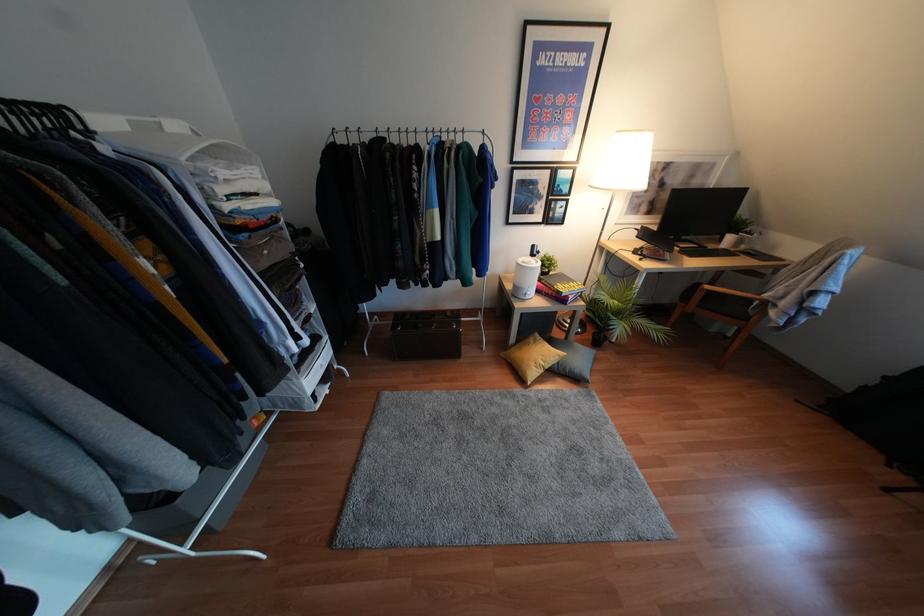
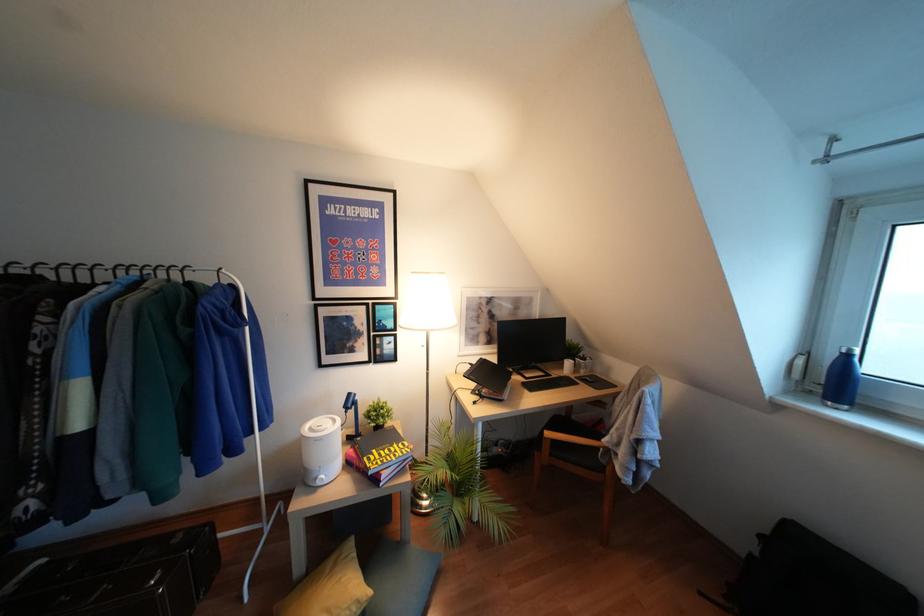
First-person continuous shooting, in which direction is the camera rotating?

The camera rotated toward right-up.